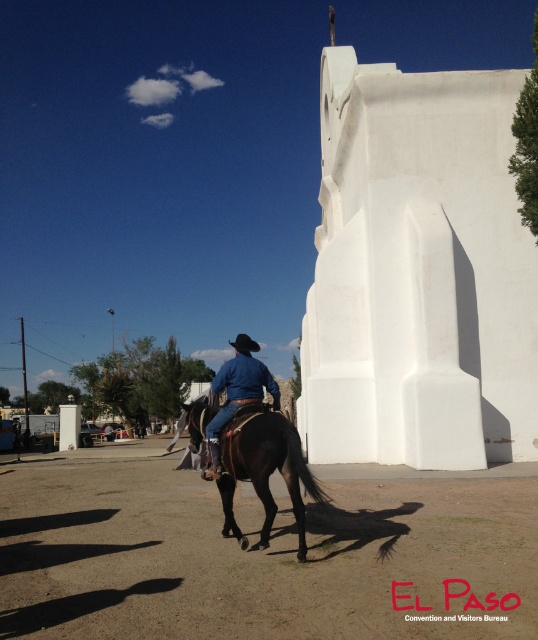
Can you confirm if brown glossy horse at center is taller than blue denim jeans at center?

In fact, brown glossy horse at center may be shorter than blue denim jeans at center.

Is brown glossy horse at center below blue denim jeans at center?

Indeed, brown glossy horse at center is positioned under blue denim jeans at center.

Identify the location of brown glossy horse at center. The height and width of the screenshot is (640, 538). (265, 468).